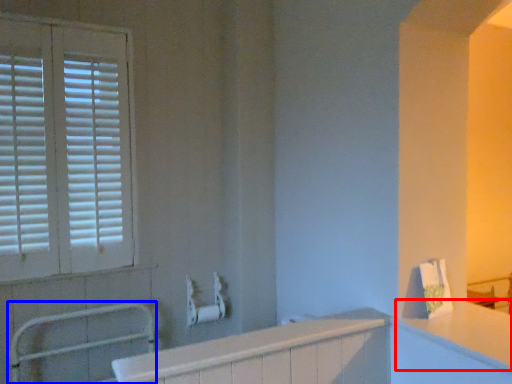
Question: Which object appears farthest to the camera in this image, counter top (highlighted by a red box) or balustrade (highlighted by a blue box)?

Choices:
 (A) counter top
 (B) balustrade

Answer: (B)